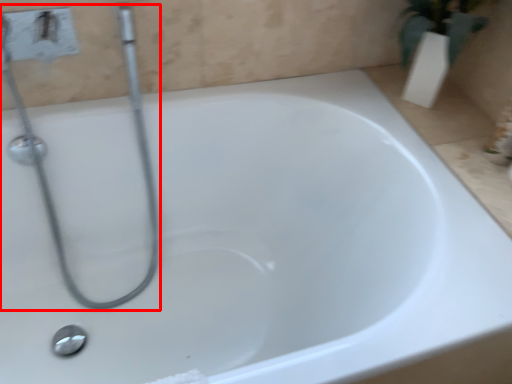
Question: From the image's perspective, what is the correct spatial relationship of plumbing fixture (annotated by the red box) in relation to shower?

Choices:
 (A) below
 (B) above

Answer: (B)